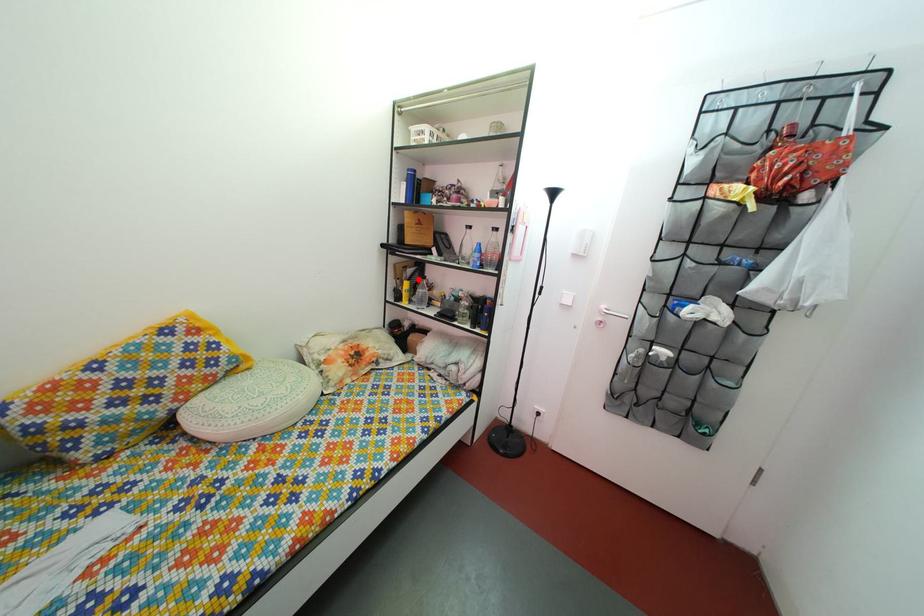
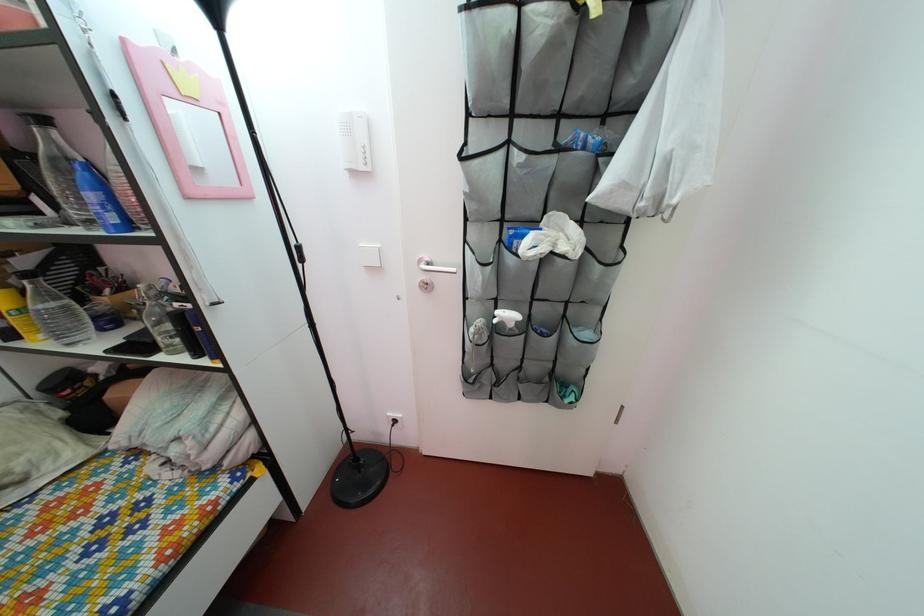
Question: I am providing you with two images of the same scene from different viewpoints. Image1 has a red point marked. In image2, the corresponding 3D location appears at what relative position? Reply with the corresponding letter.

Choices:
 (A) Closer
 (B) Farther

Answer: (B)